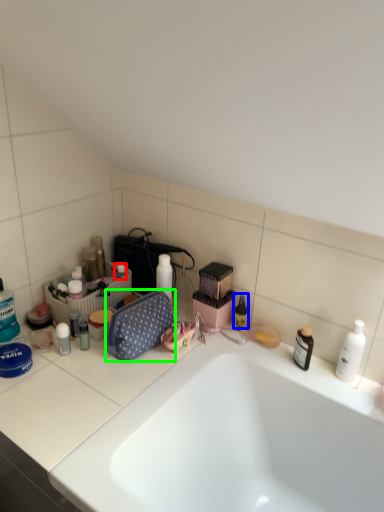
Question: Which object is positioned farthest from toiletry (highlighted by a red box)? Select from toiletry (highlighted by a blue box) and bag (highlighted by a green box).

Choices:
 (A) toiletry
 (B) bag

Answer: (A)